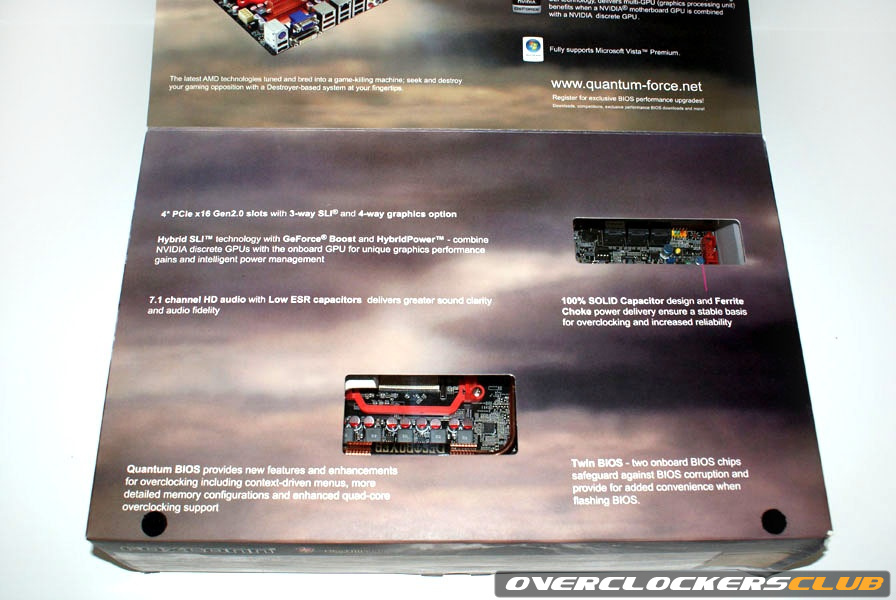
Where is `box`? This screenshot has height=600, width=896. box is located at coordinates (797, 473).